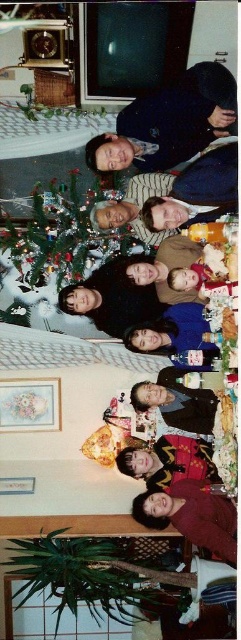
Between matte black shirt at center and smooth beige sweater at center, which one is positioned lower?

Positioned lower is matte black shirt at center.

Locate an element on the screen. matte black shirt at center is located at coordinates (113, 298).

The height and width of the screenshot is (640, 241). Describe the element at coordinates (113, 298) in the screenshot. I see `matte black shirt at center` at that location.

At what (x,y) coordinates should I click in order to perform the action: click on matte black shirt at center. Please return your answer as a coordinate pair (x, y). The height and width of the screenshot is (640, 241). Looking at the image, I should click on (113, 298).

Does matte black sweater at upper center have a larger size compared to maroon sweater at lower center?

Indeed, matte black sweater at upper center has a larger size compared to maroon sweater at lower center.

Can you confirm if matte black sweater at upper center is shorter than maroon sweater at lower center?

In fact, matte black sweater at upper center may be taller than maroon sweater at lower center.

Which is behind, point (151, 100) or point (179, 531)?

Point (151, 100)

At what (x,y) coordinates should I click in order to perform the action: click on matte black sweater at upper center. Please return your answer as a coordinate pair (x, y). The width and height of the screenshot is (241, 640). Looking at the image, I should click on (169, 122).

Is matte black sweater at upper center below smooth beige sweater at center?

Incorrect, matte black sweater at upper center is not positioned below smooth beige sweater at center.

Who is more distant from viewer, (159,147) or (192,250)?

The point (192,250) is more distant.

I want to click on matte black sweater at upper center, so click(169, 122).